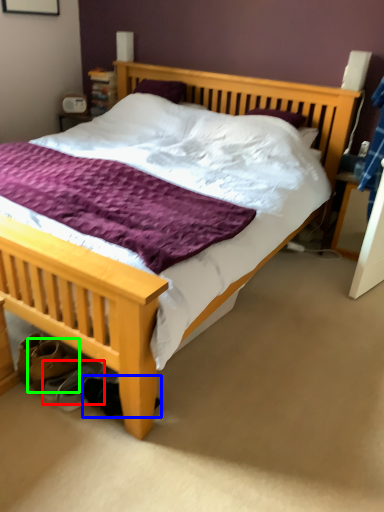
Question: Which object is positioned farthest from shoe (highlighted by a red box)? Select from shoe (highlighted by a blue box) and footwear (highlighted by a green box).

Choices:
 (A) shoe
 (B) footwear

Answer: (A)